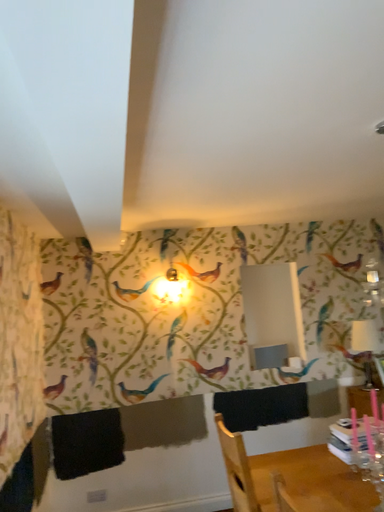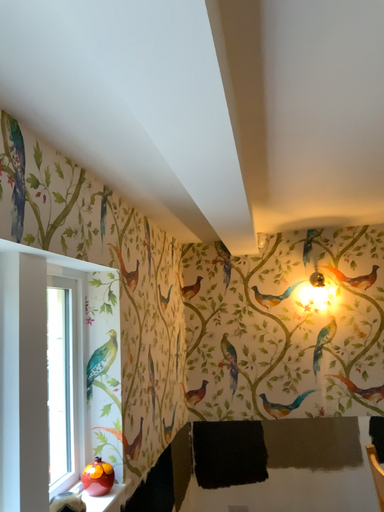
Question: Which way did the camera rotate in the video?

Choices:
 (A) rotated left
 (B) rotated right

Answer: (A)